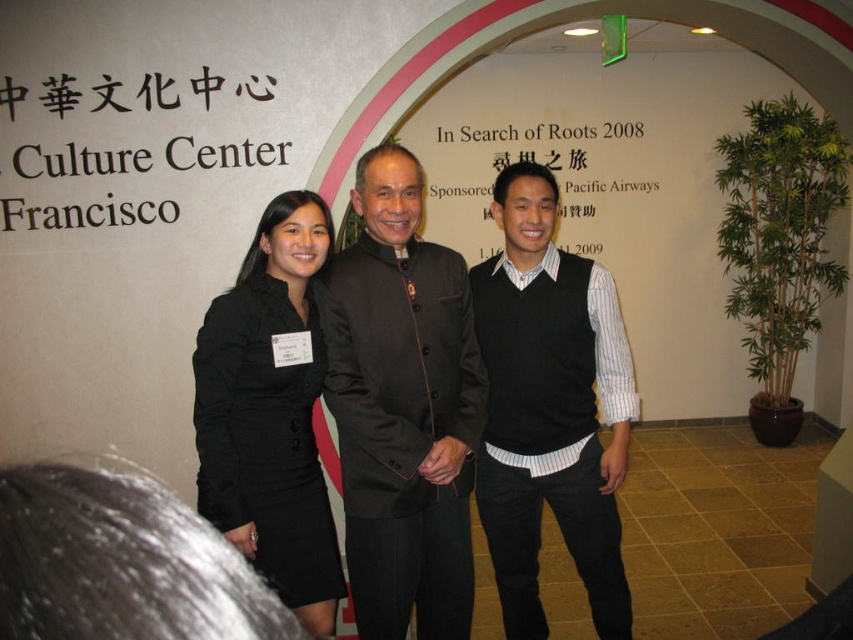
Which is below, dark brown satin jacket at center or black knit vest at center?

Positioned lower is black knit vest at center.

Is dark brown satin jacket at center thinner than black knit vest at center?

Yes.

At what (x,y) coordinates should I click in order to perform the action: click on dark brown satin jacket at center. Please return your answer as a coordinate pair (x, y). The image size is (853, 640). Looking at the image, I should click on (402, 406).

Is the position of dark brown satin jacket at center less distant than that of black satin dress at center?

That is False.

Is point (369, 611) closer to viewer compared to point (219, 422)?

No, (369, 611) is behind (219, 422).

This screenshot has width=853, height=640. What are the coordinates of `dark brown satin jacket at center` in the screenshot? It's located at (402, 406).

Can you confirm if black knit vest at center is shorter than black satin dress at center?

No, black knit vest at center is not shorter than black satin dress at center.

Which is behind, point (555, 429) or point (285, 572)?

The point (555, 429) is behind.

The width and height of the screenshot is (853, 640). What are the coordinates of `black knit vest at center` in the screenshot? It's located at (550, 408).